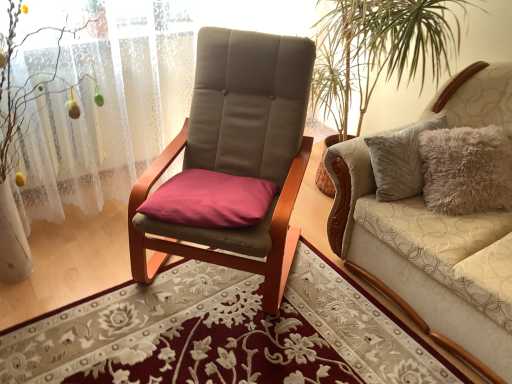
Question: Are beige fabric couch at right and white lace curtain at left far apart?

Choices:
 (A) yes
 (B) no

Answer: (A)

Question: From a real-world perspective, is beige fabric couch at right on white lace curtain at left?

Choices:
 (A) no
 (B) yes

Answer: (A)

Question: Does beige fabric couch at right have a larger size compared to white lace curtain at left?

Choices:
 (A) no
 (B) yes

Answer: (B)

Question: Considering the relative sizes of beige fabric couch at right and white lace curtain at left in the image provided, is beige fabric couch at right shorter than white lace curtain at left?

Choices:
 (A) no
 (B) yes

Answer: (B)

Question: Is beige fabric couch at right in front of white lace curtain at left?

Choices:
 (A) yes
 (B) no

Answer: (A)

Question: Is beige fabric couch at right in contact with white lace curtain at left?

Choices:
 (A) no
 (B) yes

Answer: (A)

Question: Does white lace curtain at left have a smaller size compared to beige fabric couch at right?

Choices:
 (A) yes
 (B) no

Answer: (A)

Question: From a real-world perspective, is white lace curtain at left on top of beige fabric couch at right?

Choices:
 (A) yes
 (B) no

Answer: (A)

Question: Does white lace curtain at left come in front of beige fabric couch at right?

Choices:
 (A) no
 (B) yes

Answer: (A)

Question: Is white lace curtain at left oriented away from beige fabric couch at right?

Choices:
 (A) no
 (B) yes

Answer: (A)

Question: Can you confirm if white lace curtain at left is wider than beige fabric couch at right?

Choices:
 (A) yes
 (B) no

Answer: (B)

Question: Can you confirm if white lace curtain at left is positioned to the left of beige fabric couch at right?

Choices:
 (A) no
 (B) yes

Answer: (B)

Question: Looking at their shapes, would you say beige fabric couch at right is wider or thinner than white lace curtain at left?

Choices:
 (A) thin
 (B) wide

Answer: (B)